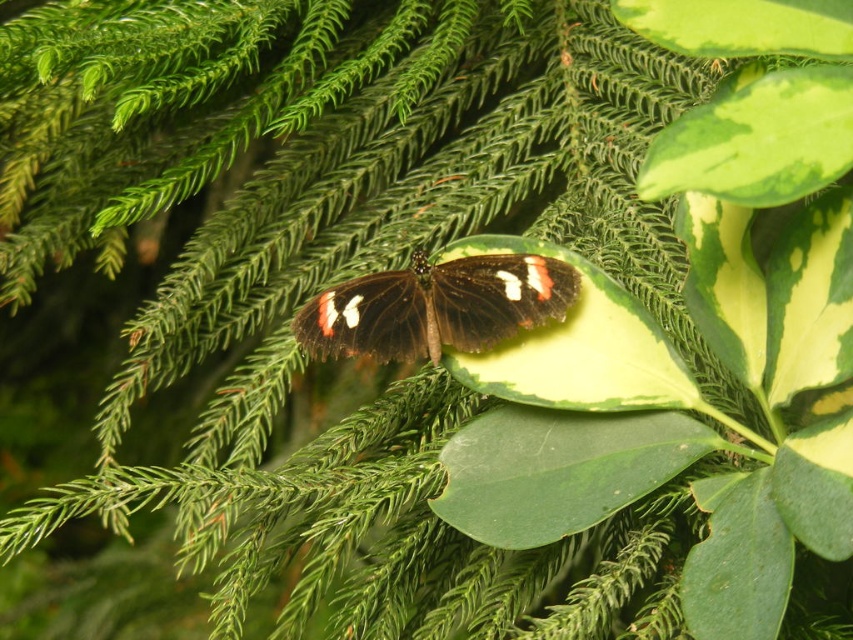
Does black glossy butterfly at center have a greater width compared to green glossy leaf at upper right?

Yes, black glossy butterfly at center is wider than green glossy leaf at upper right.

Which of these two, black glossy butterfly at center or green glossy leaf at upper right, stands taller?

green glossy leaf at upper right

Who is more forward, (331, 288) or (639, 188)?

Point (639, 188) is more forward.

Find the location of a particular element. black glossy butterfly at center is located at coordinates (437, 307).

Between green glossy leaf at center and green glossy leaf at upper right, which one is positioned higher?

green glossy leaf at upper right is higher up.

Does green glossy leaf at center appear on the right side of green glossy leaf at upper right?

Incorrect, green glossy leaf at center is not on the right side of green glossy leaf at upper right.

This screenshot has height=640, width=853. In order to click on green glossy leaf at center in this screenshot , I will do `click(558, 468)`.

Image resolution: width=853 pixels, height=640 pixels. Identify the location of green glossy leaf at center. (558, 468).

Which of these two, green glossy leaf at center or black glossy butterfly at center, stands shorter?

With less height is black glossy butterfly at center.

Who is more distant from viewer, (476,440) or (380,330)?

The point (380,330) is more distant.

Describe the element at coordinates (558, 468) in the screenshot. I see `green glossy leaf at center` at that location.

This screenshot has width=853, height=640. What are the coordinates of `green glossy leaf at center` in the screenshot? It's located at (558, 468).